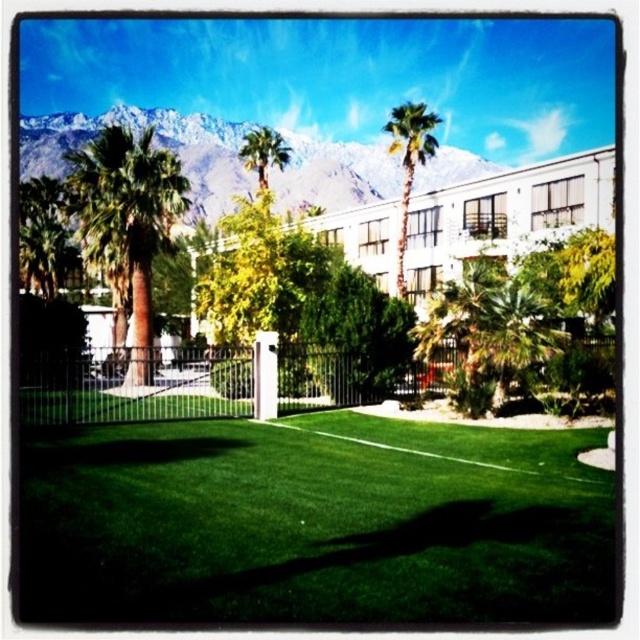
Is white metal fence at center further to camera compared to green leafy palm tree at center?

No.

Is white metal fence at center smaller than green leafy palm tree at center?

Yes.

Locate an element on the screen. The height and width of the screenshot is (640, 640). white metal fence at center is located at coordinates (138, 387).

Image resolution: width=640 pixels, height=640 pixels. Describe the element at coordinates (128, 218) in the screenshot. I see `brown textured palm tree at left` at that location.

Where is `brown textured palm tree at left`? This screenshot has width=640, height=640. brown textured palm tree at left is located at coordinates (128, 218).

Between point (140, 342) and point (250, 138), which one is positioned in front?

Point (140, 342) is more forward.

This screenshot has height=640, width=640. I want to click on brown textured palm tree at left, so click(128, 218).

In the scene shown: Is green artificial turf at lower center bigger than brown textured palm tree at left?

Actually, green artificial turf at lower center might be smaller than brown textured palm tree at left.

Where is `green artificial turf at lower center`? green artificial turf at lower center is located at coordinates (316, 522).